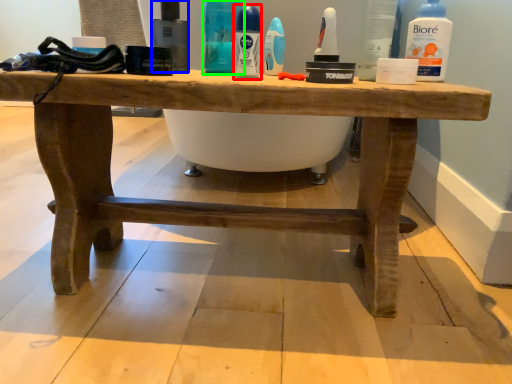
Question: Estimate the real-world distances between objects in this image. Which object is closer to mouthwash (highlighted by a red box), mouthwash (highlighted by a blue box) or cleaning product (highlighted by a green box)?

Choices:
 (A) mouthwash
 (B) cleaning product

Answer: (B)